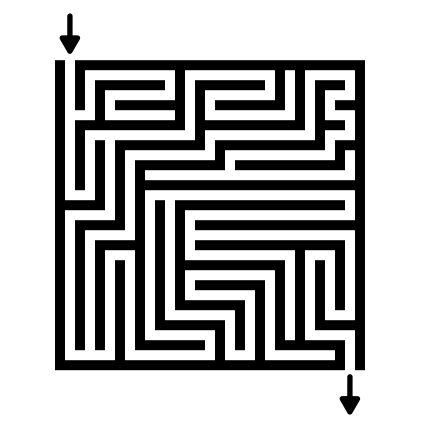
Locate an element on the screen. This screenshot has height=426, width=426. corners is located at coordinates (358, 65), (62, 367).